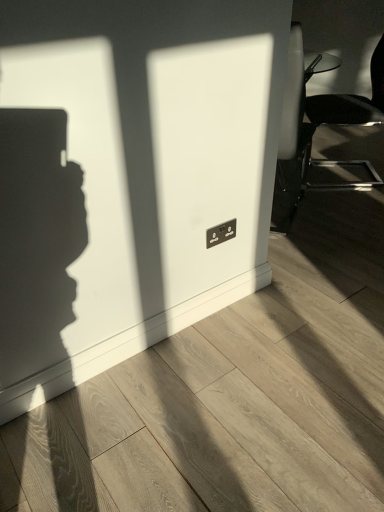
Question: Considering the relative sizes of metallic silver chair at right and black plastic electric outlet at center in the image provided, is metallic silver chair at right shorter than black plastic electric outlet at center?

Choices:
 (A) yes
 (B) no

Answer: (B)

Question: Can you confirm if metallic silver chair at right is thinner than black plastic electric outlet at center?

Choices:
 (A) yes
 (B) no

Answer: (B)

Question: From a real-world perspective, is metallic silver chair at right below black plastic electric outlet at center?

Choices:
 (A) yes
 (B) no

Answer: (B)

Question: Is black plastic electric outlet at center located within metallic silver chair at right?

Choices:
 (A) yes
 (B) no

Answer: (B)

Question: From the image's perspective, would you say metallic silver chair at right is positioned over black plastic electric outlet at center?

Choices:
 (A) no
 (B) yes

Answer: (B)

Question: Considering the relative positions of metallic silver chair at right and black plastic electric outlet at center in the image provided, is metallic silver chair at right in front of black plastic electric outlet at center?

Choices:
 (A) yes
 (B) no

Answer: (B)

Question: From a real-world perspective, is black plastic electric outlet at center on metallic silver chair at right?

Choices:
 (A) yes
 (B) no

Answer: (B)

Question: Does black plastic electric outlet at center have a lesser width compared to metallic silver chair at right?

Choices:
 (A) yes
 (B) no

Answer: (A)

Question: Is black plastic electric outlet at center in front of metallic silver chair at right?

Choices:
 (A) no
 (B) yes

Answer: (B)

Question: Is black plastic electric outlet at center beside metallic silver chair at right?

Choices:
 (A) no
 (B) yes

Answer: (A)

Question: Would you consider black plastic electric outlet at center to be distant from metallic silver chair at right?

Choices:
 (A) no
 (B) yes

Answer: (B)

Question: Could you tell me if black plastic electric outlet at center is facing metallic silver chair at right?

Choices:
 (A) yes
 (B) no

Answer: (B)

Question: Considering the positions of black plastic electric outlet at center and metallic silver chair at right in the image, is black plastic electric outlet at center bigger or smaller than metallic silver chair at right?

Choices:
 (A) small
 (B) big

Answer: (A)